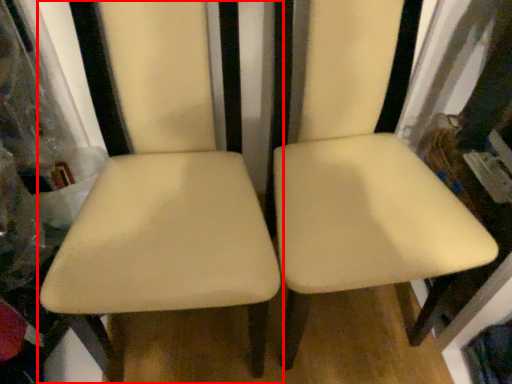
Question: Observing the image, what is the correct spatial positioning of chair (annotated by the red box) in reference to chair?

Choices:
 (A) left
 (B) right

Answer: (A)